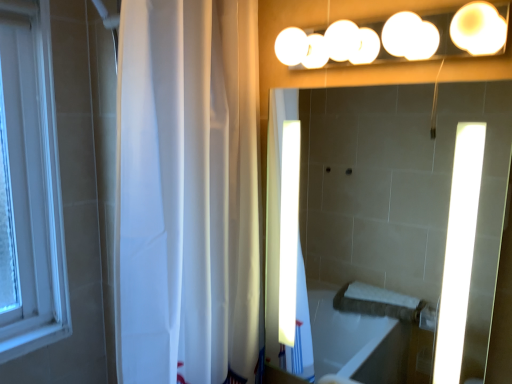
Question: Should I look upward or downward to see white glossy mirror at upper center?

Choices:
 (A) up
 (B) down

Answer: (B)

Question: Considering the relative sizes of white glossy lights at upper center and white glossy mirror at upper center in the image provided, is white glossy lights at upper center smaller than white glossy mirror at upper center?

Choices:
 (A) yes
 (B) no

Answer: (A)

Question: Is white glossy lights at upper center to the right of white glossy mirror at upper center from the viewer's perspective?

Choices:
 (A) yes
 (B) no

Answer: (B)

Question: Can white glossy mirror at upper center be found inside white glossy lights at upper center?

Choices:
 (A) yes
 (B) no

Answer: (B)

Question: Is white glossy lights at upper center not inside white glossy mirror at upper center?

Choices:
 (A) no
 (B) yes

Answer: (B)

Question: Would you consider white glossy lights at upper center to be distant from white glossy mirror at upper center?

Choices:
 (A) no
 (B) yes

Answer: (B)

Question: From the image's perspective, is white glossy lights at upper center located above white glossy mirror at upper center?

Choices:
 (A) no
 (B) yes

Answer: (B)

Question: From the image's perspective, would you say white sheer curtain at left is shown under white glossy lights at upper center?

Choices:
 (A) yes
 (B) no

Answer: (A)

Question: Would you say white glossy lights at upper center is part of white sheer curtain at left's contents?

Choices:
 (A) no
 (B) yes

Answer: (A)

Question: Considering the relative sizes of white sheer curtain at left and white glossy lights at upper center in the image provided, is white sheer curtain at left smaller than white glossy lights at upper center?

Choices:
 (A) yes
 (B) no

Answer: (B)

Question: From a real-world perspective, does white sheer curtain at left sit lower than white glossy lights at upper center?

Choices:
 (A) no
 (B) yes

Answer: (B)

Question: Is white sheer curtain at left facing towards white glossy lights at upper center?

Choices:
 (A) no
 (B) yes

Answer: (A)

Question: Does white sheer curtain at left have a larger size compared to white glossy lights at upper center?

Choices:
 (A) yes
 (B) no

Answer: (A)

Question: Is white glossy mirror at upper center at the back of white sheer curtain at left?

Choices:
 (A) no
 (B) yes

Answer: (A)